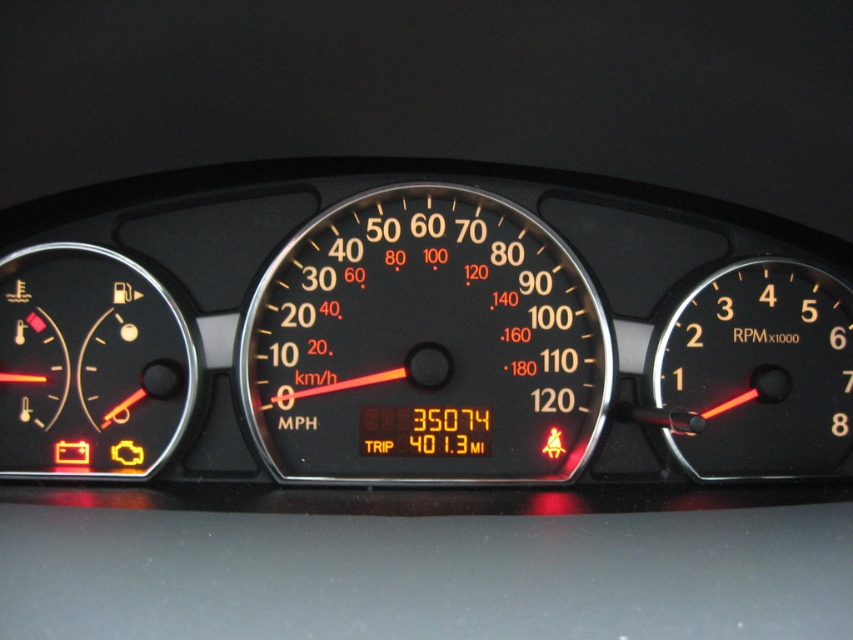
Between point (509, 227) and point (743, 444), which one is positioned in front?

Point (743, 444)

Is point (354, 444) more distant than point (787, 444)?

No, it is not.

Is point (454, 196) positioned behind point (775, 371)?

Yes.

Identify the location of black plastic speedometer at center. This screenshot has width=853, height=640. (425, 346).

Is black plastic speedometer at center below matte black speedometer at left?

No.

Is black plastic speedometer at center bigger than matte black speedometer at left?

Correct, black plastic speedometer at center is larger in size than matte black speedometer at left.

This screenshot has width=853, height=640. I want to click on black plastic speedometer at center, so click(x=425, y=346).

At what (x,y) coordinates should I click in order to perform the action: click on black plastic speedometer at center. Please return your answer as a coordinate pair (x, y). The height and width of the screenshot is (640, 853). Looking at the image, I should click on (425, 346).

This screenshot has height=640, width=853. I want to click on matte black speedometer at left, so click(x=90, y=365).

Who is more forward, (167,397) or (764,419)?

Point (167,397) is more forward.

You are a GUI agent. You are given a task and a screenshot of the screen. Output one action in this format:
    pyautogui.click(x=<x>, y=<y>)
    Task: Click on the matte black speedometer at left
    
    Given the screenshot: What is the action you would take?
    pyautogui.click(x=90, y=365)